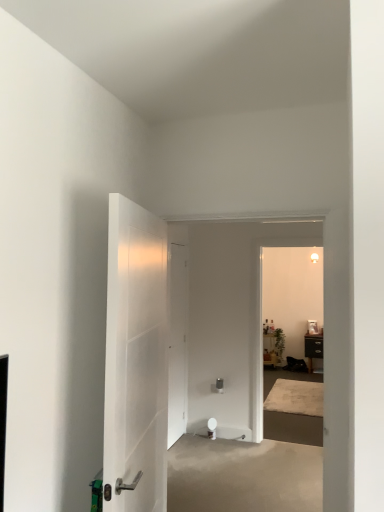
The image size is (384, 512). Find the location of `free point in front of white matte door at center, positioned as the 2th door in front-to-back order`. free point in front of white matte door at center, positioned as the 2th door in front-to-back order is located at coordinates (191, 451).